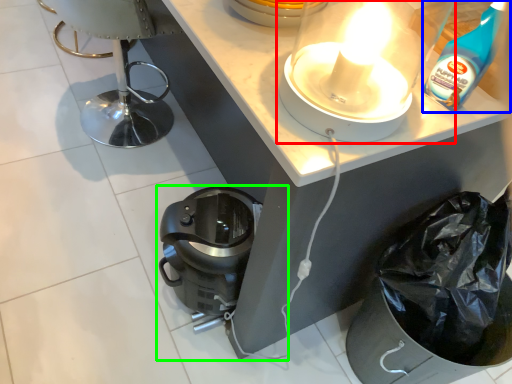
Question: Considering the real-world distances, which object is closest to kitchen appliance (highlighted by a red box)? cleaning product (highlighted by a blue box) or home appliance (highlighted by a green box).

Choices:
 (A) cleaning product
 (B) home appliance

Answer: (A)